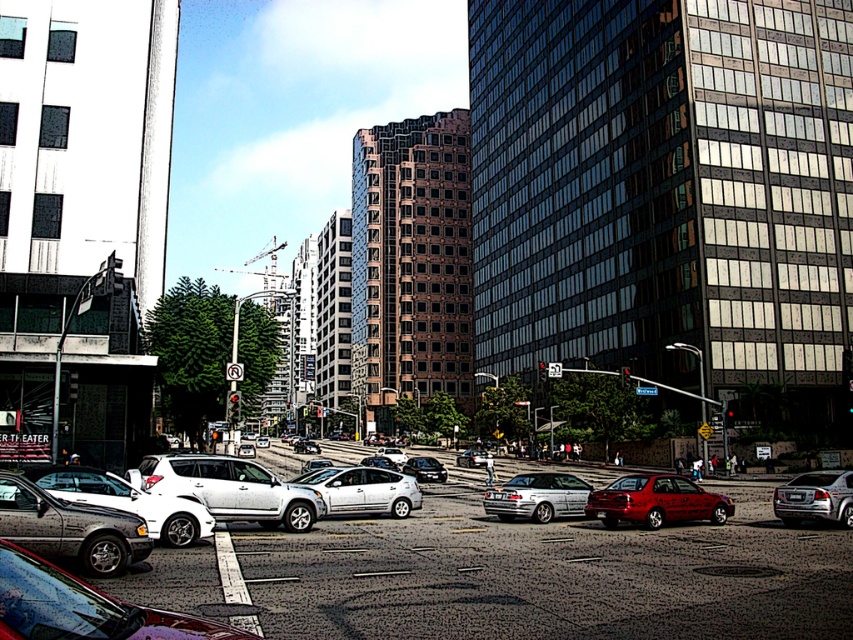
Is point (32, 518) more distant than point (218, 476)?

That is False.

Does silver metallic sedan at lower left appear under white matte suv at center?

Incorrect, silver metallic sedan at lower left is not positioned below white matte suv at center.

In order to click on silver metallic sedan at lower left in this screenshot , I will do `click(68, 528)`.

Does shiny black sedan at center come in front of satin silver car at center?

Yes, it is in front of satin silver car at center.

Can you confirm if shiny black sedan at center is bigger than satin silver car at center?

No.

The height and width of the screenshot is (640, 853). I want to click on shiny black sedan at center, so click(x=83, y=608).

Image resolution: width=853 pixels, height=640 pixels. What do you see at coordinates (654, 500) in the screenshot? I see `shiny red sedan at center` at bounding box center [654, 500].

Between shiny red sedan at center and shiny silver sedan at center, which one has less height?

With less height is shiny red sedan at center.

Between point (602, 502) and point (426, 456), which one is positioned behind?

The point (426, 456) is behind.

At what (x,y) coordinates should I click in order to perform the action: click on shiny red sedan at center. Please return your answer as a coordinate pair (x, y). This screenshot has width=853, height=640. Looking at the image, I should click on click(x=654, y=500).